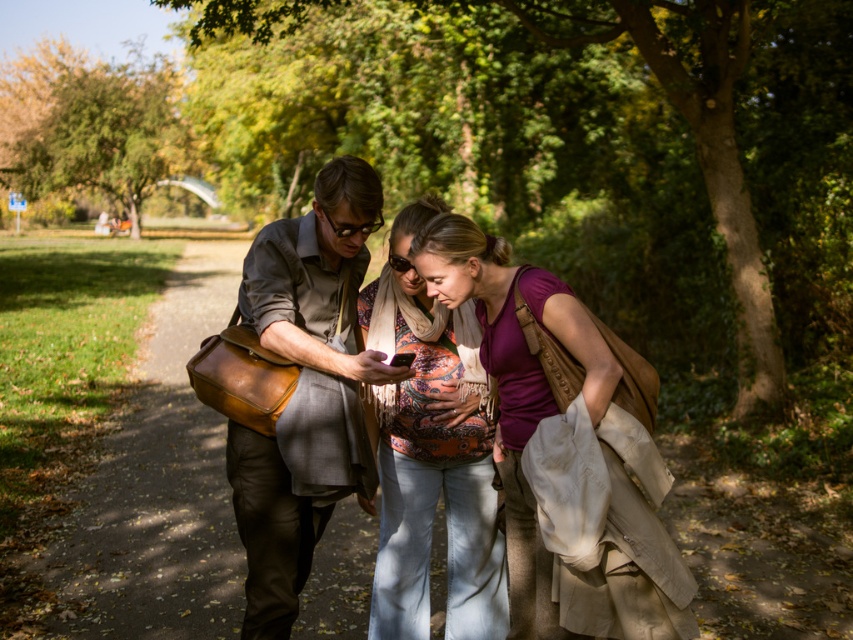
Is matte brown leather bag at center shorter than matte orange scarf at center?

Yes.

From the picture: Is matte brown leather bag at center below matte orange scarf at center?

No.

What do you see at coordinates (305, 388) in the screenshot? This screenshot has height=640, width=853. I see `matte brown leather bag at center` at bounding box center [305, 388].

This screenshot has height=640, width=853. I want to click on matte brown leather bag at center, so click(x=305, y=388).

Is purple cotton shirt at center taller than matte orange scarf at center?

No, purple cotton shirt at center is not taller than matte orange scarf at center.

Is purple cotton shirt at center behind matte orange scarf at center?

No, purple cotton shirt at center is closer to the viewer.

This screenshot has height=640, width=853. Find the location of `purple cotton shirt at center`. purple cotton shirt at center is located at coordinates (566, 449).

Between point (598, 520) and point (334, 236), which one is positioned behind?

The point (334, 236) is more distant.

Where is `purple cotton shirt at center`? The height and width of the screenshot is (640, 853). purple cotton shirt at center is located at coordinates (566, 449).